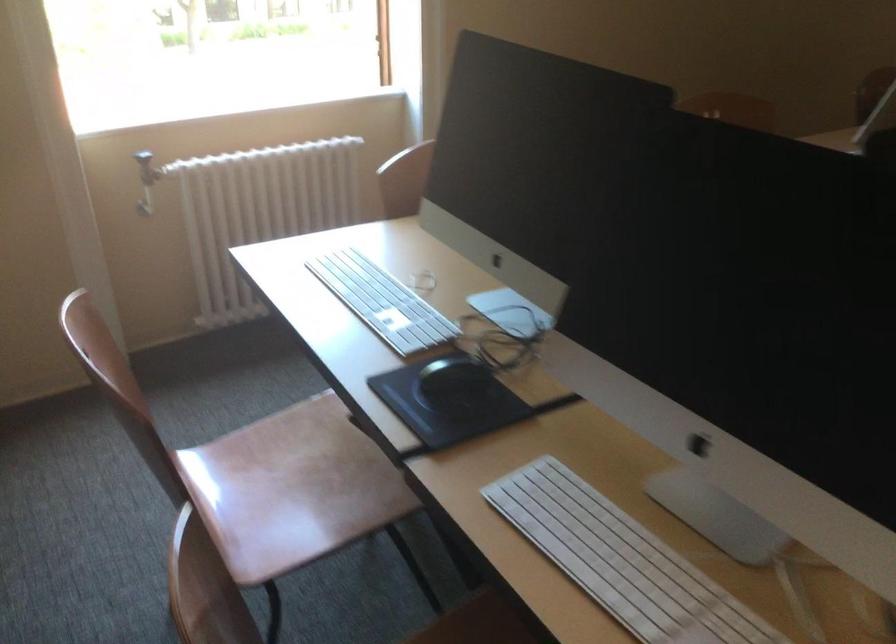
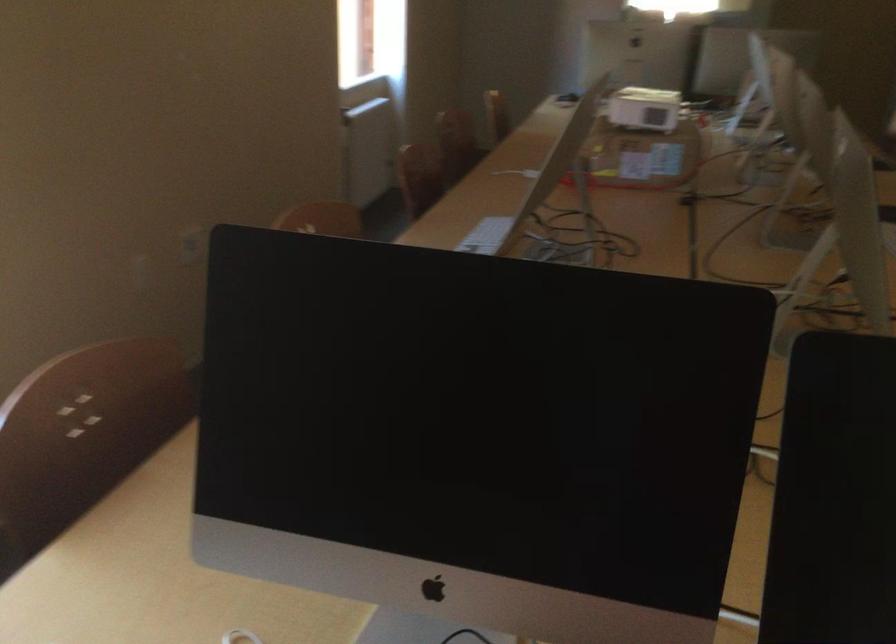
Question: The camera is either moving clockwise (left) or counter-clockwise (right) around the object. The first image is from the beginning of the video and the second image is from the end. Is the camera moving left or right when shooting the video?

Choices:
 (A) Left
 (B) Right

Answer: (A)